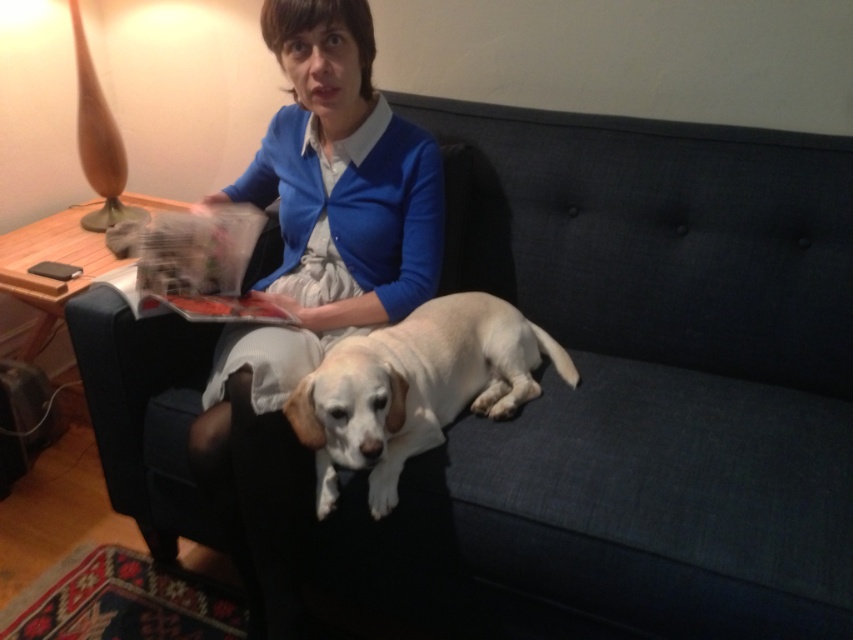
Question: Which point is closer to the camera taking this photo?

Choices:
 (A) (288, 440)
 (B) (270, 236)
 (C) (299, 385)

Answer: (C)

Question: Which object appears closest to the camera in this image?

Choices:
 (A) white fur dog at center
 (B) white fabric armchair at center

Answer: (A)

Question: Which object appears closest to the camera in this image?

Choices:
 (A) white fur dog at center
 (B) white fabric armchair at center
 (C) matte blue sweater at center

Answer: (A)

Question: Is matte blue sweater at center to the left of white fabric armchair at center from the viewer's perspective?

Choices:
 (A) yes
 (B) no

Answer: (B)

Question: Can you confirm if white fur dog at center is wider than white fabric armchair at center?

Choices:
 (A) yes
 (B) no

Answer: (A)

Question: Can you confirm if matte blue sweater at center is positioned to the left of white fur dog at center?

Choices:
 (A) no
 (B) yes

Answer: (B)